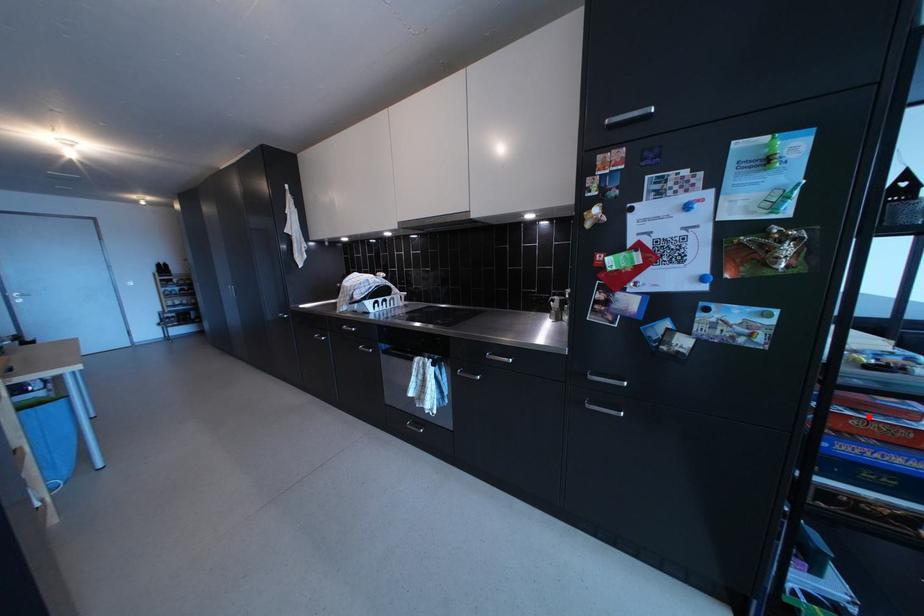
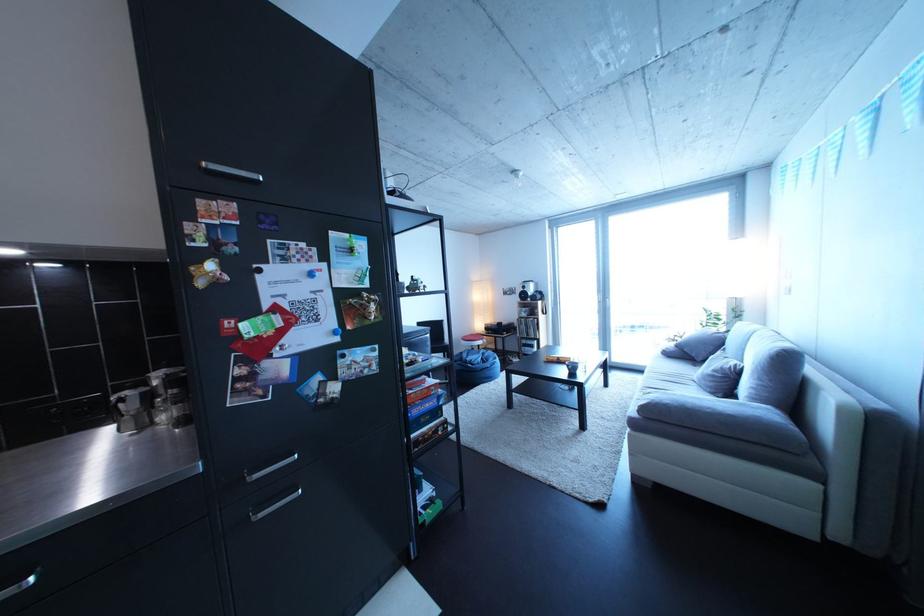
Question: I am providing you with two images of the same scene from different viewpoints. Image1 has a red point marked. In image2, the corresponding 3D location appears at what relative position? Reply with the corresponding letter.

Choices:
 (A) Closer
 (B) Farther

Answer: (B)